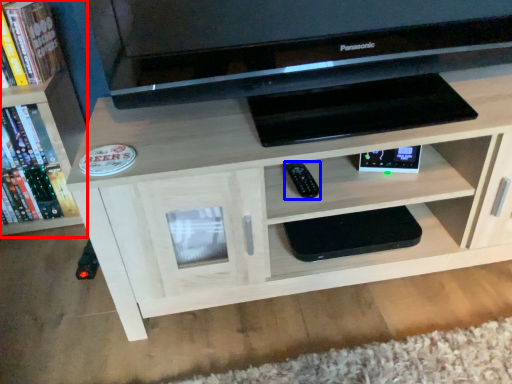
Question: Which of the following is the farthest to the observer, bookcase (highlighted by a red box) or remote (highlighted by a blue box)?

Choices:
 (A) bookcase
 (B) remote

Answer: (A)